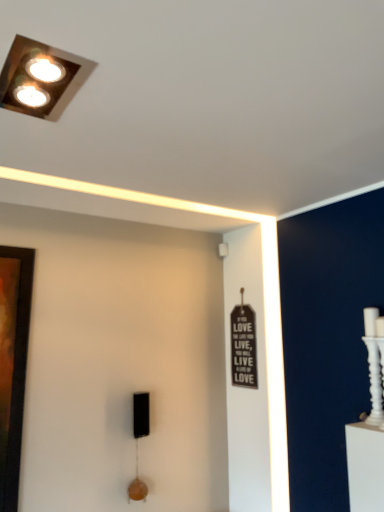
What do you see at coordinates (373, 366) in the screenshot? This screenshot has width=384, height=512. I see `white textured candle holder at right` at bounding box center [373, 366].

The width and height of the screenshot is (384, 512). I want to click on white textured candle holder at right, so click(x=373, y=366).

What is the approximate width of white textured candle holder at right?

The width of white textured candle holder at right is 3.75 inches.

This screenshot has height=512, width=384. What do you see at coordinates (41, 78) in the screenshot? I see `metallic square light fixture at upper left` at bounding box center [41, 78].

The width and height of the screenshot is (384, 512). Find the location of `metallic square light fixture at upper left`. metallic square light fixture at upper left is located at coordinates [41, 78].

The width and height of the screenshot is (384, 512). In order to click on white textured candle holder at right in this screenshot , I will do `click(373, 366)`.

Is white textured candle holder at right at the left side of metallic square light fixture at upper left?

No, white textured candle holder at right is not to the left of metallic square light fixture at upper left.

Relative to metallic square light fixture at upper left, is white textured candle holder at right in front or behind?

In the image, white textured candle holder at right appears behind metallic square light fixture at upper left.

Which point is more distant from viewer, (375, 356) or (40, 94)?

The point (375, 356) is behind.

From the image's perspective, which is below, white textured candle holder at right or metallic square light fixture at upper left?

white textured candle holder at right is shown below in the image.

From a real-world perspective, which object stands above the other?

metallic square light fixture at upper left is physically above.

Considering the sizes of objects white textured candle holder at right and metallic square light fixture at upper left in the image provided, who is thinner, white textured candle holder at right or metallic square light fixture at upper left?

white textured candle holder at right.

Considering the sizes of objects white textured candle holder at right and metallic square light fixture at upper left in the image provided, who is taller, white textured candle holder at right or metallic square light fixture at upper left?

With more height is white textured candle holder at right.

From the picture: Considering the relative sizes of white textured candle holder at right and metallic square light fixture at upper left in the image provided, is white textured candle holder at right bigger than metallic square light fixture at upper left?

Indeed, white textured candle holder at right has a larger size compared to metallic square light fixture at upper left.

Looking at this image, does white textured candle holder at right contain metallic square light fixture at upper left?

No, metallic square light fixture at upper left is not surrounded by white textured candle holder at right.

Is white textured candle holder at right not close to metallic square light fixture at upper left?

That's right, there is a large distance between white textured candle holder at right and metallic square light fixture at upper left.

Is white textured candle holder at right facing towards metallic square light fixture at upper left?

Yes.

I want to click on candle holder that is under the metallic square light fixture at upper left (from a real-world perspective), so click(x=373, y=366).

Is metallic square light fixture at upper left at the right side of white textured candle holder at right?

In fact, metallic square light fixture at upper left is to the left of white textured candle holder at right.

Which is behind, metallic square light fixture at upper left or white textured candle holder at right?

Positioned behind is white textured candle holder at right.

Is point (48, 78) closer or farther from the camera than point (378, 362)?

Clearly, point (48, 78) is closer to the camera than point (378, 362).

From the image's perspective, is metallic square light fixture at upper left beneath white textured candle holder at right?

No, from the image's perspective, metallic square light fixture at upper left is not beneath white textured candle holder at right.

From a real-world perspective, is metallic square light fixture at upper left physically located above or below white textured candle holder at right?

metallic square light fixture at upper left is above white textured candle holder at right.

Which object is wider, metallic square light fixture at upper left or white textured candle holder at right?

metallic square light fixture at upper left is wider.

Considering the sizes of objects metallic square light fixture at upper left and white textured candle holder at right in the image provided, who is taller, metallic square light fixture at upper left or white textured candle holder at right?

white textured candle holder at right is taller.

Who is bigger, metallic square light fixture at upper left or white textured candle holder at right?

With larger size is white textured candle holder at right.

Is metallic square light fixture at upper left surrounding white textured candle holder at right?

That's incorrect, white textured candle holder at right is not inside metallic square light fixture at upper left.

Does metallic square light fixture at upper left touch white textured candle holder at right?

No.

Is metallic square light fixture at upper left facing towards white textured candle holder at right?

No.

How many degrees apart are the facing directions of metallic square light fixture at upper left and white textured candle holder at right?

The angle between the facing direction of metallic square light fixture at upper left and the facing direction of white textured candle holder at right is 90.4 degrees.

Consider the image. Could you measure the distance between metallic square light fixture at upper left and white textured candle holder at right?

metallic square light fixture at upper left is 1.66 meters away from white textured candle holder at right.

I want to click on candle holder behind the metallic square light fixture at upper left, so click(373, 366).

I want to click on lamp lying in front of the white textured candle holder at right, so click(41, 78).

Locate an element on the screen. candle holder behind the metallic square light fixture at upper left is located at coordinates (373, 366).